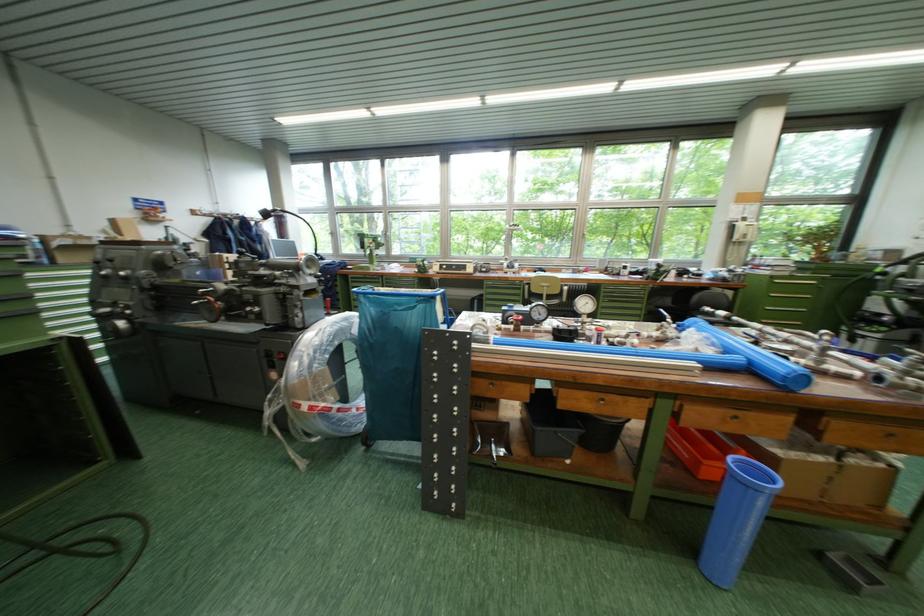
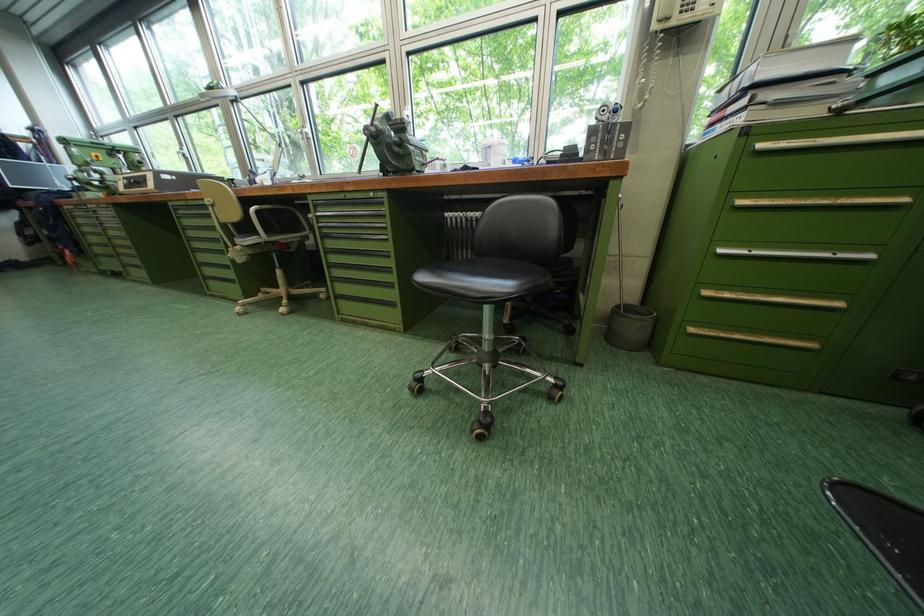
The images are taken continuously from a first-person perspective. In which direction are you moving?

The cameraman moved toward right, forward.